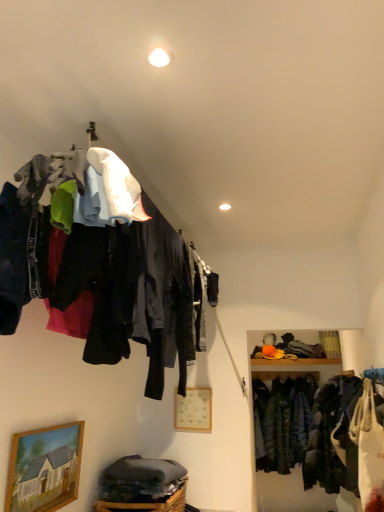
Question: Is dark green quilted jacket at lower right touching woven brown basket at lower center?

Choices:
 (A) yes
 (B) no

Answer: (B)

Question: Is dark green quilted jacket at lower right thinner than woven brown basket at lower center?

Choices:
 (A) no
 (B) yes

Answer: (B)

Question: From the image's perspective, does dark green quilted jacket at lower right appear lower than woven brown basket at lower center?

Choices:
 (A) no
 (B) yes

Answer: (B)

Question: Considering the relative sizes of dark green quilted jacket at lower right and woven brown basket at lower center in the image provided, is dark green quilted jacket at lower right wider than woven brown basket at lower center?

Choices:
 (A) no
 (B) yes

Answer: (A)

Question: Is dark green quilted jacket at lower right oriented towards woven brown basket at lower center?

Choices:
 (A) no
 (B) yes

Answer: (A)

Question: Is point (16, 477) closer or farther from the camera than point (97, 507)?

Choices:
 (A) farther
 (B) closer

Answer: (B)

Question: From the image's perspective, is wooden framed painting at lower left, which is the first picture frame in left-to-right order, positioned above or below woven brown basket at lower center?

Choices:
 (A) below
 (B) above

Answer: (B)

Question: Considering the relative positions of wooden framed painting at lower left, which is the first picture frame in left-to-right order, and woven brown basket at lower center in the image provided, is wooden framed painting at lower left, which is the first picture frame in left-to-right order, to the left or to the right of woven brown basket at lower center?

Choices:
 (A) right
 (B) left

Answer: (B)

Question: In the image, is wooden framed painting at lower left, the 2th picture frame from the back, positioned in front of or behind woven brown basket at lower center?

Choices:
 (A) behind
 (B) front

Answer: (B)

Question: In terms of height, does woven brown basket at lower center look taller or shorter compared to wooden picture frame at center, which ranks as the 2th picture frame in left-to-right order?

Choices:
 (A) tall
 (B) short

Answer: (B)

Question: Would you say woven brown basket at lower center is inside or outside wooden picture frame at center, which ranks as the 2th picture frame in left-to-right order?

Choices:
 (A) inside
 (B) outside

Answer: (B)

Question: Based on their positions, is woven brown basket at lower center located to the left or right of wooden picture frame at center, acting as the first picture frame starting from the back?

Choices:
 (A) left
 (B) right

Answer: (A)

Question: In terms of width, does woven brown basket at lower center look wider or thinner when compared to wooden picture frame at center, the first picture frame when ordered from right to left?

Choices:
 (A) wide
 (B) thin

Answer: (A)

Question: From a real-world perspective, is matte fabric clothes at upper left physically located above or below wooden picture frame at center, which ranks as the 2th picture frame in left-to-right order?

Choices:
 (A) below
 (B) above

Answer: (B)

Question: Is matte fabric clothes at upper left in front of or behind wooden picture frame at center, acting as the first picture frame starting from the back, in the image?

Choices:
 (A) front
 (B) behind

Answer: (A)